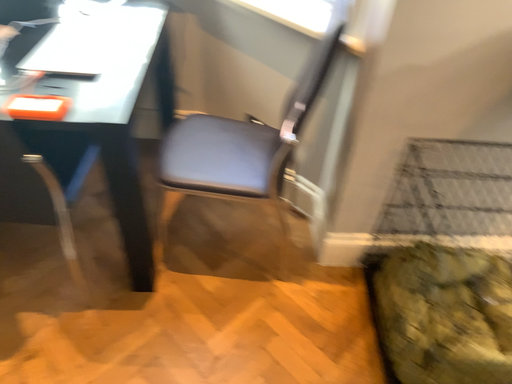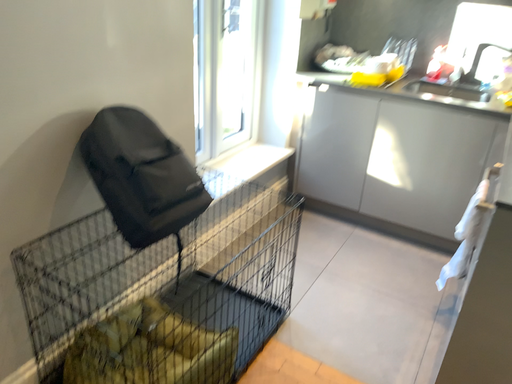
Question: Which way did the camera rotate in the video?

Choices:
 (A) rotated downward
 (B) rotated upward

Answer: (B)